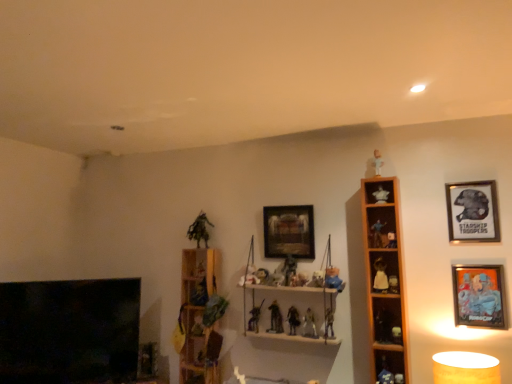
Looking at this image, what is the approximate height of matte plastic action figure at center, the 9th toy when ordered from right to left?

It is 13.54 centimeters.

The width and height of the screenshot is (512, 384). Describe the element at coordinates (391, 240) in the screenshot. I see `matte black action figure at upper right, the second toy when ordered from right to left` at that location.

Describe the element at coordinates (69, 331) in the screenshot. The height and width of the screenshot is (384, 512). I see `black glass fireplace at lower left` at that location.

Describe the element at coordinates (280, 290) in the screenshot. I see `wooden shelf at center, the second shelf positioned from the left` at that location.

At what (x,y) coordinates should I click in order to perform the action: click on matte plastic action figure at center, the twelfth toy from the left. Please return your answer as a coordinate pair (x, y). The width and height of the screenshot is (512, 384). Looking at the image, I should click on (333, 279).

Which object is positioned more to the left, matte plastic action figure at center, which is the 4th toy in left-to-right order, or matte plastic action figure at center, the twelfth toy from the left?

matte plastic action figure at center, which is the 4th toy in left-to-right order, is more to the left.

In the scene shown: Could you tell me if matte plastic action figure at center, which ranks as the seventeenth toy in right-to-left order, is facing matte plastic action figure at center, the 9th toy when ordered from right to left?

No, matte plastic action figure at center, which ranks as the seventeenth toy in right-to-left order, is not turned towards matte plastic action figure at center, the 9th toy when ordered from right to left.

Is matte plastic action figure at center, which ranks as the seventeenth toy in right-to-left order, touching matte plastic action figure at center, the twelfth toy from the left?

No.

From the picture: Is white matte figurine at right, the 7th toy in the right-to-left sequence, a part of matte plastic action figure at center, which ranks as the seventeenth toy in right-to-left order?

No, white matte figurine at right, the 7th toy in the right-to-left sequence, is not inside matte plastic action figure at center, which ranks as the seventeenth toy in right-to-left order.

Considering the relative sizes of matte plastic action figure at center, which ranks as the seventeenth toy in right-to-left order, and white matte figurine at right, the fourteenth toy positioned from the left, in the image provided, is matte plastic action figure at center, which ranks as the seventeenth toy in right-to-left order, smaller than white matte figurine at right, the fourteenth toy positioned from the left,?

Yes, matte plastic action figure at center, which ranks as the seventeenth toy in right-to-left order, is smaller than white matte figurine at right, the fourteenth toy positioned from the left.

Can you confirm if matte plastic action figure at center, which is the 4th toy in left-to-right order, is positioned to the left of white matte figurine at right, the fourteenth toy positioned from the left?

Correct, you'll find matte plastic action figure at center, which is the 4th toy in left-to-right order, to the left of white matte figurine at right, the fourteenth toy positioned from the left.

Between matte plastic action figure at center, which ranks as the seventeenth toy in right-to-left order, and white matte figurine at right, the fourteenth toy positioned from the left, which one has more height?

Standing taller between the two is white matte figurine at right, the fourteenth toy positioned from the left.

Could you tell me if metallic silver picture frame at upper right, the 2th picture frame in the front-to-back sequence, is turned towards matte plastic toy at center, which is counted as the fifth toy, starting from the left?

No, metallic silver picture frame at upper right, the 2th picture frame in the front-to-back sequence, is not aimed at matte plastic toy at center, which is counted as the fifth toy, starting from the left.

In the image, is metallic silver picture frame at upper right, marked as the 1th picture frame in a right-to-left arrangement, on the left side or the right side of matte plastic toy at center, which is counted as the fifth toy, starting from the left?

metallic silver picture frame at upper right, marked as the 1th picture frame in a right-to-left arrangement, is positioned on matte plastic toy at center, which is counted as the fifth toy, starting from the left,'s right side.

From a real-world perspective, who is located higher, metallic silver picture frame at upper right, the 3th picture frame when ordered from left to right, or matte plastic toy at center, which is counted as the fifth toy, starting from the left?

metallic silver picture frame at upper right, the 3th picture frame when ordered from left to right.

Is there a large distance between metallic silver picture frame at upper right, the 2th picture frame in the front-to-back sequence, and matte plastic toy at center, which is counted as the 16th toy, starting from the right?

Indeed, metallic silver picture frame at upper right, the 2th picture frame in the front-to-back sequence, is not near matte plastic toy at center, which is counted as the 16th toy, starting from the right.

Can you tell me how much green matte toy at upper center, acting as the 1th toy starting from the left, and wooden framed picture at center, which is the third picture frame in right-to-left order, differ in facing direction?

green matte toy at upper center, acting as the 1th toy starting from the left, and wooden framed picture at center, which is the third picture frame in right-to-left order, are facing 0.00229 degrees away from each other.

From the image's perspective, is green matte toy at upper center, which appears as the twentieth toy when viewed from the right, positioned above or below wooden framed picture at center, which is the first picture frame from back to front?

Based on their image positions, green matte toy at upper center, which appears as the twentieth toy when viewed from the right, is located beneath wooden framed picture at center, which is the first picture frame from back to front.

Would you consider green matte toy at upper center, acting as the 1th toy starting from the left, to be distant from wooden framed picture at center, which is the third picture frame in right-to-left order?

They are positioned close to each other.

Considering the sizes of objects green matte toy at upper center, which appears as the twentieth toy when viewed from the right, and wooden framed picture at center, which is the first picture frame from back to front, in the image provided, who is taller, green matte toy at upper center, which appears as the twentieth toy when viewed from the right, or wooden framed picture at center, which is the first picture frame from back to front,?

wooden framed picture at center, which is the first picture frame from back to front, is taller.

Between point (281, 217) and point (267, 289), which one is positioned behind?

Positioned behind is point (281, 217).

Considering the sizes of wooden framed picture at center, which is the first picture frame from back to front, and wooden shelf at center, the second shelf positioned from the left, in the image, is wooden framed picture at center, which is the first picture frame from back to front, wider or thinner than wooden shelf at center, the second shelf positioned from the left,?

Considering their sizes, wooden framed picture at center, which is the first picture frame from back to front, looks slimmer than wooden shelf at center, the second shelf positioned from the left.

How different are the orientations of wooden framed picture at center, marked as the 1th picture frame in a left-to-right arrangement, and wooden shelf at center, which appears as the second shelf when viewed from the right, in degrees?

0.000365 degrees separate the facing orientations of wooden framed picture at center, marked as the 1th picture frame in a left-to-right arrangement, and wooden shelf at center, which appears as the second shelf when viewed from the right.

Is white matte figurine at right, the 7th toy in the right-to-left sequence, far from metallic silver picture frame at right, positioned as the 1th picture frame in front-to-back order?

That's not correct — white matte figurine at right, the 7th toy in the right-to-left sequence, is a little close to metallic silver picture frame at right, positioned as the 1th picture frame in front-to-back order.

Is the position of white matte figurine at right, the 7th toy in the right-to-left sequence, less distant than that of metallic silver picture frame at right, the 3th picture frame in the back-to-front sequence?

No, white matte figurine at right, the 7th toy in the right-to-left sequence, is behind metallic silver picture frame at right, the 3th picture frame in the back-to-front sequence.

Can you confirm if white matte figurine at right, the 7th toy in the right-to-left sequence, is smaller than metallic silver picture frame at right, positioned as the 1th picture frame in front-to-back order?

Yes.

Considering the sizes of objects white matte figurine at right, the 7th toy in the right-to-left sequence, and metallic silver picture frame at right, positioned as the 1th picture frame in front-to-back order, in the image provided, who is wider, white matte figurine at right, the 7th toy in the right-to-left sequence, or metallic silver picture frame at right, positioned as the 1th picture frame in front-to-back order,?

white matte figurine at right, the 7th toy in the right-to-left sequence, is wider.

What's the angular difference between wooden shelves at center, acting as the 3th shelf starting from the right, and green matte toy at upper center, which appears as the twentieth toy when viewed from the right,'s facing directions?

The angular difference between wooden shelves at center, acting as the 3th shelf starting from the right, and green matte toy at upper center, which appears as the twentieth toy when viewed from the right, is 0.00178 degrees.

Considering the relative positions of wooden shelves at center, arranged as the first shelf when viewed from the left, and green matte toy at upper center, acting as the 1th toy starting from the left, in the image provided, is wooden shelves at center, arranged as the first shelf when viewed from the left, to the right of green matte toy at upper center, acting as the 1th toy starting from the left, from the viewer's perspective?

Yes.

Is wooden shelves at center, arranged as the first shelf when viewed from the left, spatially inside green matte toy at upper center, acting as the 1th toy starting from the left, or outside of it?

The correct answer is: outside.

Locate an element on the screen. This screenshot has height=384, width=512. the 9th toy in front of the matte plastic action figure at center, which ranks as the seventeenth toy in right-to-left order is located at coordinates tap(333, 279).

From the image's perspective, which toy is the 7th one above the matte plastic action figure at center, which ranks as the seventeenth toy in right-to-left order? Please provide its 2D coordinates.

[(380, 276)]

From the picture: Considering their positions, is wooden shelf at center, which appears as the second shelf when viewed from the right, positioned further to matte plastic action figure at center, positioned as the 10th toy in left-to-right order, than metallic silver figure at center, arranged as the 8th toy when viewed from the left?

Among the two, metallic silver figure at center, arranged as the 8th toy when viewed from the left, is located further to matte plastic action figure at center, positioned as the 10th toy in left-to-right order.

Based on their spatial positions, is matte plastic figurine at center, which is counted as the 19th toy, starting from the right, or wooden shelf at right, the first shelf positioned from the right, further from metallic silver picture frame at upper right, which is the second picture frame from back to front?

matte plastic figurine at center, which is counted as the 19th toy, starting from the right, is further to metallic silver picture frame at upper right, which is the second picture frame from back to front.

Estimate the real-world distances between objects in this image. Which object is closer to metallic silver figure at center, arranged as the 8th toy when viewed from the left, wooden shelf at right, placed as the 3th shelf when sorted from left to right, or wooden shelves at center, arranged as the first shelf when viewed from the left?

The object closer to metallic silver figure at center, arranged as the 8th toy when viewed from the left, is wooden shelves at center, arranged as the first shelf when viewed from the left.

Estimate the real-world distances between objects in this image. Which object is closer to metallic silver picture frame at right, the 2th picture frame from the left, matte plastic action figure at center, the twelfth toy from the left, or matte plastic toy at center, which ranks as the first toy in right-to-left order?

matte plastic toy at center, which ranks as the first toy in right-to-left order, is positioned closer to the anchor metallic silver picture frame at right, the 2th picture frame from the left.

Estimate the real-world distances between objects in this image. Which object is closer to matte black figurine at upper right, the 16th toy when ordered from left to right, black glass fireplace at lower left or wooden shelf at center, which appears as the second shelf when viewed from the right?

Based on the image, wooden shelf at center, which appears as the second shelf when viewed from the right, appears to be nearer to matte black figurine at upper right, the 16th toy when ordered from left to right.

Considering their positions, is wooden shelves at center, acting as the 3th shelf starting from the right, positioned further to matte plastic toy at center, arranged as the twentieth toy when viewed from the left, than wooden shelf at right, placed as the 3th shelf when sorted from left to right?

Based on the image, wooden shelves at center, acting as the 3th shelf starting from the right, appears to be further to matte plastic toy at center, arranged as the twentieth toy when viewed from the left.

Considering their positions, is matte plastic figurine at center, placed as the sixth toy when sorted from left to right, positioned closer to matte plastic toy at center, the 10th toy positioned from the right, than matte plastic action figure at center-right, placed as the 3th toy when sorted from right to left?

matte plastic figurine at center, placed as the sixth toy when sorted from left to right, is closer to matte plastic toy at center, the 10th toy positioned from the right.

From the image, which object appears to be farther from matte plastic figurine at center, the 15th toy viewed from the right, black glass fireplace at lower left or metallic silver figurine at center, placed as the 14th toy when sorted from right to left?

black glass fireplace at lower left lies further to matte plastic figurine at center, the 15th toy viewed from the right, than the other object.

Image resolution: width=512 pixels, height=384 pixels. In order to click on table lamp between matte plastic figurine at center, which is counted as the 19th toy, starting from the right, and metallic silver picture frame at upper right, marked as the 1th picture frame in a right-to-left arrangement, in the horizontal direction in this screenshot , I will do `click(465, 368)`.

Image resolution: width=512 pixels, height=384 pixels. I want to click on shelf between metallic blue figure at upper right, which is counted as the thirteenth toy, starting from the left, and metallic silver picture frame at right, positioned as the 1th picture frame in front-to-back order, so click(384, 277).

This screenshot has width=512, height=384. I want to click on shelf situated between wooden shelves at center, acting as the 3th shelf starting from the right, and metallic silver figure at center, which is the thirteenth toy in right-to-left order, from left to right, so click(280, 290).

The width and height of the screenshot is (512, 384). I want to click on shelf between matte plastic action figure at center, the 9th toy when ordered from right to left, and metallic silver picture frame at upper right, marked as the 1th picture frame in a right-to-left arrangement, so click(384, 277).